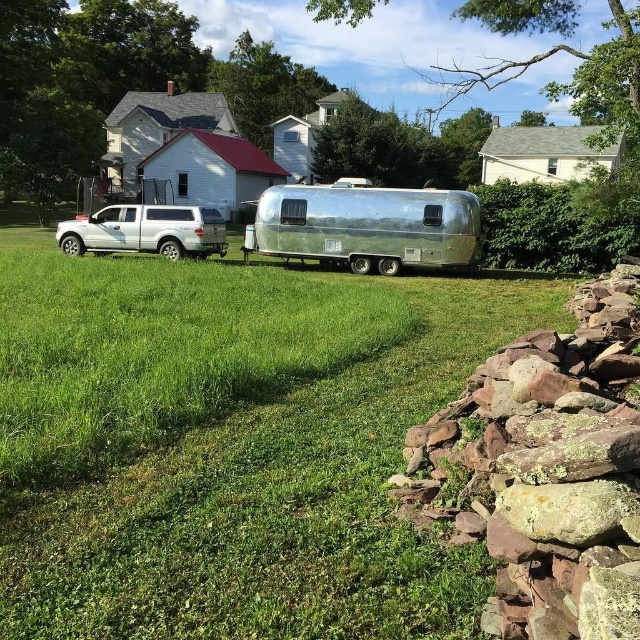
Question: Is the position of green grass at center more distant than that of rusty stone wall at lower right?

Choices:
 (A) no
 (B) yes

Answer: (B)

Question: Which object appears closest to the camera in this image?

Choices:
 (A) silver metallic trailer at center
 (B) green grass at center

Answer: (B)

Question: Does green grass at center have a smaller size compared to silver metallic trailer at center?

Choices:
 (A) yes
 (B) no

Answer: (B)

Question: Which point is farther to the camera?

Choices:
 (A) green grass at center
 (B) rusty stone wall at lower right

Answer: (A)

Question: Can you confirm if silver metallic trailer at center is positioned to the left of white matte truck at left?

Choices:
 (A) yes
 (B) no

Answer: (B)

Question: Which object is the closest to the rusty stone wall at lower right?

Choices:
 (A) green grass at center
 (B) silver metallic trailer at center
 (C) white matte truck at left

Answer: (A)